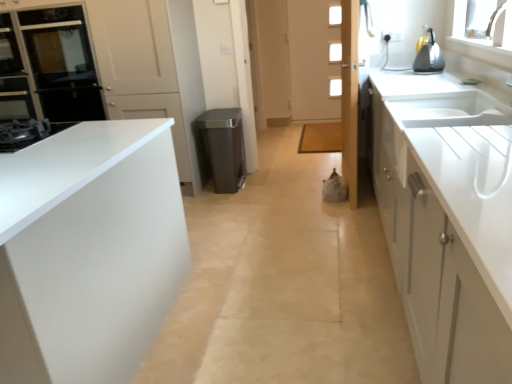
Question: From the image's perspective, would you say white wooden door at center, the first door viewed from the back, is positioned over black glass oven at upper left?

Choices:
 (A) no
 (B) yes

Answer: (B)

Question: Considering the relative sizes of white wooden door at center, arranged as the 3th door when viewed from the front, and black glass oven at upper left in the image provided, is white wooden door at center, arranged as the 3th door when viewed from the front, wider than black glass oven at upper left?

Choices:
 (A) no
 (B) yes

Answer: (A)

Question: Is white wooden door at center, positioned as the 1th door in right-to-left order, far away from black glass oven at upper left?

Choices:
 (A) no
 (B) yes

Answer: (B)

Question: Is white wooden door at center, the 3th door viewed from the left, not within black glass oven at upper left?

Choices:
 (A) yes
 (B) no

Answer: (A)

Question: From a real-world perspective, is white wooden door at center, arranged as the 3th door when viewed from the front, located beneath black glass oven at upper left?

Choices:
 (A) yes
 (B) no

Answer: (A)

Question: From their relative heights in the image, would you say white wooden door at center, the first door viewed from the back, is taller or shorter than black glass oven at upper left?

Choices:
 (A) tall
 (B) short

Answer: (A)

Question: Considering the relative positions of white wooden door at center, positioned as the 1th door in right-to-left order, and black glass oven at upper left in the image provided, is white wooden door at center, positioned as the 1th door in right-to-left order, to the left or to the right of black glass oven at upper left?

Choices:
 (A) left
 (B) right

Answer: (B)

Question: In the image, is white wooden door at center, positioned as the 1th door in right-to-left order, positioned in front of or behind black glass oven at upper left?

Choices:
 (A) behind
 (B) front

Answer: (A)

Question: Is white wooden door at center, positioned as the 1th door in right-to-left order, spatially inside black glass oven at upper left, or outside of it?

Choices:
 (A) outside
 (B) inside

Answer: (A)

Question: Would you say white glossy door at center, the 2th door when ordered from front to back, is inside or outside gray matte trash can at center?

Choices:
 (A) inside
 (B) outside

Answer: (B)

Question: In terms of size, does white glossy door at center, the 2th door when ordered from front to back, appear bigger or smaller than gray matte trash can at center?

Choices:
 (A) small
 (B) big

Answer: (B)

Question: Considering the positions of white glossy door at center, the 3th door in the right-to-left sequence, and gray matte trash can at center in the image, is white glossy door at center, the 3th door in the right-to-left sequence, wider or thinner than gray matte trash can at center?

Choices:
 (A) wide
 (B) thin

Answer: (B)

Question: Is white glossy door at center, the 2th door when ordered from front to back, taller or shorter than gray matte trash can at center?

Choices:
 (A) tall
 (B) short

Answer: (A)

Question: Considering the positions of white wooden door at center, the first door viewed from the back, and white glossy door at center, marked as the first door in a left-to-right arrangement, in the image, is white wooden door at center, the first door viewed from the back, wider or thinner than white glossy door at center, marked as the first door in a left-to-right arrangement,?

Choices:
 (A) wide
 (B) thin

Answer: (A)

Question: Is white wooden door at center, positioned as the 1th door in right-to-left order, to the left or to the right of white glossy door at center, the 3th door in the right-to-left sequence, in the image?

Choices:
 (A) left
 (B) right

Answer: (B)